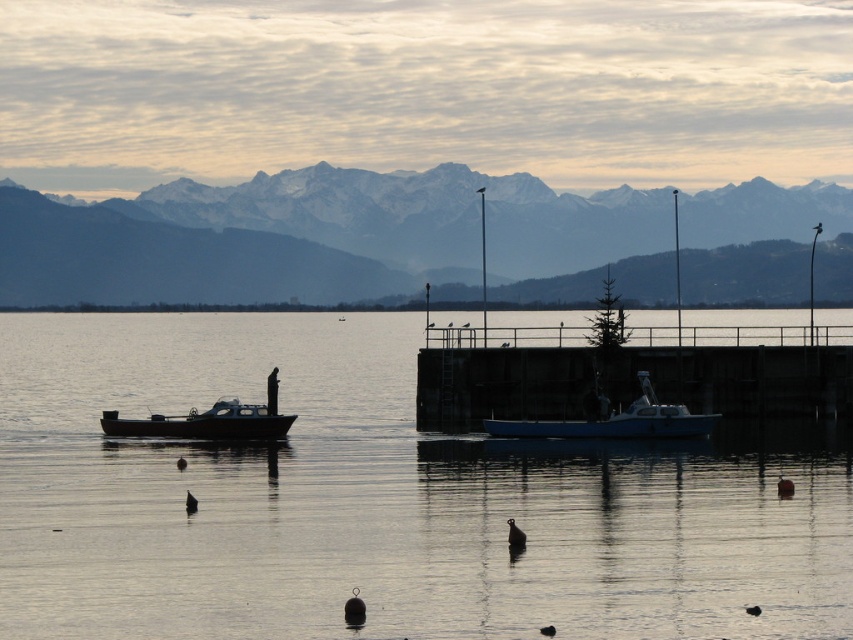
Question: Which point is closer to the camera taking this photo?

Choices:
 (A) (630, 396)
 (B) (201, 424)

Answer: (B)

Question: Among these points, which one is nearest to the camera?

Choices:
 (A) 245,424
 (B) 669,428
 (C) 16,609
 (D) 247,230

Answer: (C)

Question: Which object is positioned closest to the snowy mountain range at upper center?

Choices:
 (A) smooth concrete dock at center
 (B) blue matte boat at center

Answer: (A)

Question: Does smooth concrete dock at center lie in front of wooden boat at left?

Choices:
 (A) no
 (B) yes

Answer: (A)

Question: Is smooth water at center smaller than snowy mountain range at upper center?

Choices:
 (A) no
 (B) yes

Answer: (A)

Question: Does snowy mountain range at upper center appear on the right side of wooden boat at left?

Choices:
 (A) no
 (B) yes

Answer: (B)